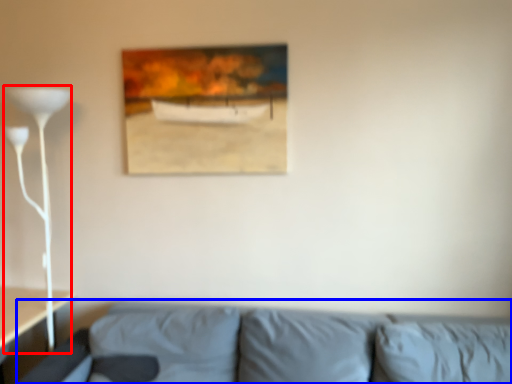
Question: Which point is closer to the camera, table lamp (highlighted by a red box) or studio couch (highlighted by a blue box)?

Choices:
 (A) table lamp
 (B) studio couch

Answer: (B)